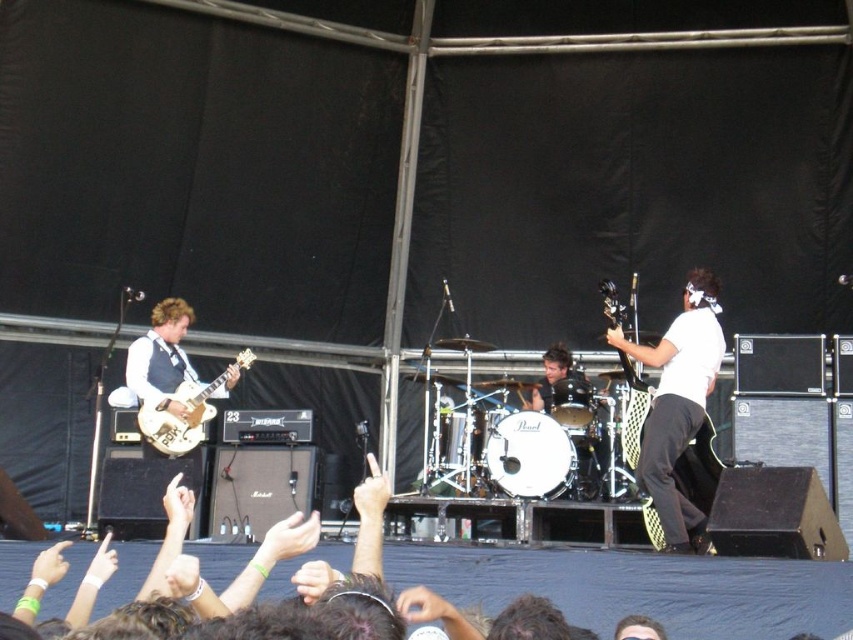
You are a photographer at the concert and want to capture both the matte gold guitar at left and the matte black electric guitar at right in a single shot. Considering their positions, which guitar is closer to the front of the stage?

The matte gold guitar at left is closer to the front of the stage because the matte black electric guitar at right is positioned behind it.

You are a stagehand at the concert venue. You need to place a microphone stand exactly at the point marked by the coordinates point (161, 358). Which object is located at that point?

The point (161, 358) is occupied by the matte gold guitar at left, so you cannot place the microphone stand there as it is already occupied by the matte gold guitar at left.

You are a photographer standing at the camera position. You want to capture a closeup shot of the matte gold guitar at left. Is it possible to do so without moving your position?

The matte gold guitar at left is 29.30 meters away from camera. Since it is quite far away, capturing a closeup shot without moving closer might be challenging due to the distance, but it depends on the camera lens capabilities. A telephoto lens could potentially achieve this.